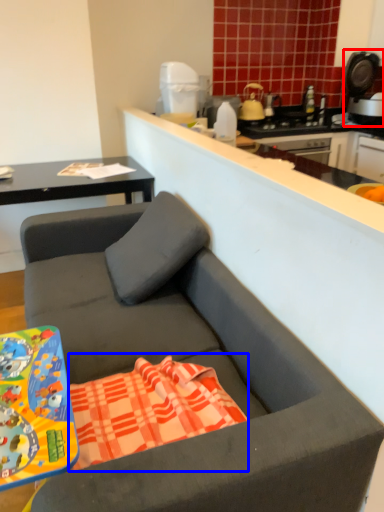
Question: Which object appears farthest to the camera in this image, coffee machine (highlighted by a red box) or beach towel (highlighted by a blue box)?

Choices:
 (A) coffee machine
 (B) beach towel

Answer: (A)